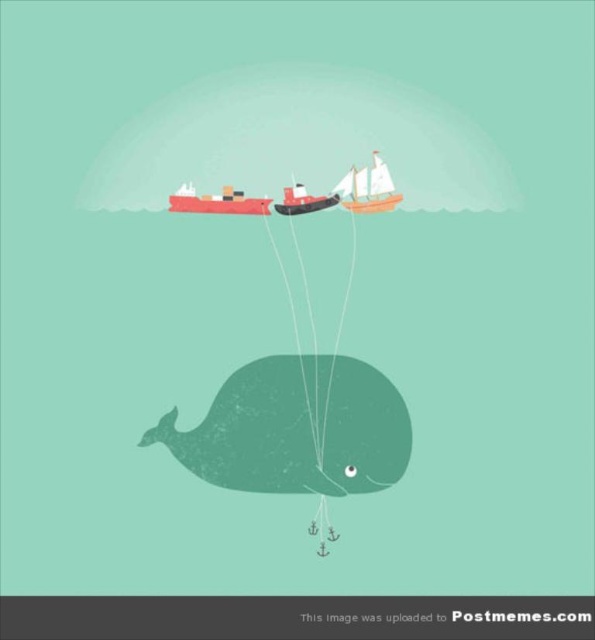
Describe the element at coordinates (368, 188) in the screenshot. I see `wooden sailboat at upper center` at that location.

Measure the distance between point (377, 161) and camera.

1.28 meters

Who is more forward, (375, 186) or (292, 189)?

Point (375, 186) is in front.

The height and width of the screenshot is (640, 595). Find the location of `wooden sailboat at upper center`. wooden sailboat at upper center is located at coordinates (368, 188).

Which is above, wooden sailboat at upper center or matte red cargo ship at upper center?

wooden sailboat at upper center is above.

The image size is (595, 640). I want to click on wooden sailboat at upper center, so [368, 188].

You are a GUI agent. You are given a task and a screenshot of the screen. Output one action in this format:
    pyautogui.click(x=<x>, y=<y>)
    Task: Click on the wooden sailboat at upper center
    The image size is (595, 640).
    Given the screenshot: What is the action you would take?
    pyautogui.click(x=368, y=188)

Does matte red cargo ship at upper center appear on the left side of smooth wood boat at upper center?

Yes, matte red cargo ship at upper center is to the left of smooth wood boat at upper center.

Which is behind, point (187, 198) or point (305, 204)?

Positioned behind is point (305, 204).

What do you see at coordinates (217, 202) in the screenshot? The width and height of the screenshot is (595, 640). I see `matte red cargo ship at upper center` at bounding box center [217, 202].

I want to click on matte red cargo ship at upper center, so point(217,202).